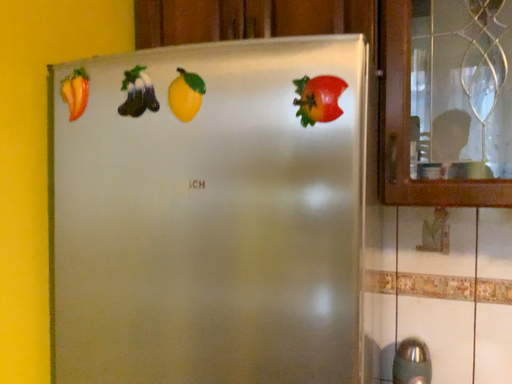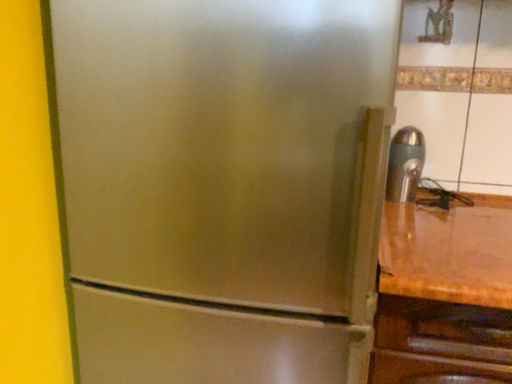
Question: How did the camera likely rotate when shooting the video?

Choices:
 (A) rotated upward
 (B) rotated downward

Answer: (B)